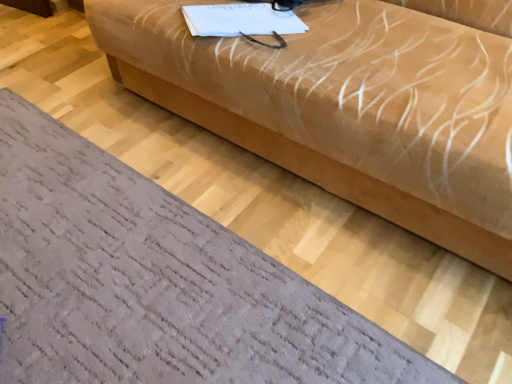
Question: Is beige fabric couch at center inside or outside of textured gray rug at lower left?

Choices:
 (A) inside
 (B) outside

Answer: (B)

Question: Based on their positions, is beige fabric couch at center located to the left or right of textured gray rug at lower left?

Choices:
 (A) left
 (B) right

Answer: (B)

Question: Is point (404, 49) closer or farther from the camera than point (157, 258)?

Choices:
 (A) closer
 (B) farther

Answer: (A)

Question: Considering the positions of point (278, 279) and point (380, 201), is point (278, 279) closer or farther from the camera than point (380, 201)?

Choices:
 (A) farther
 (B) closer

Answer: (B)

Question: From the image's perspective, relative to beige fabric couch at center, is textured gray rug at lower left above or below?

Choices:
 (A) above
 (B) below

Answer: (B)

Question: Would you say textured gray rug at lower left is to the left or to the right of beige fabric couch at center in the picture?

Choices:
 (A) right
 (B) left

Answer: (B)

Question: Is textured gray rug at lower left wider or thinner than beige fabric couch at center?

Choices:
 (A) thin
 (B) wide

Answer: (B)